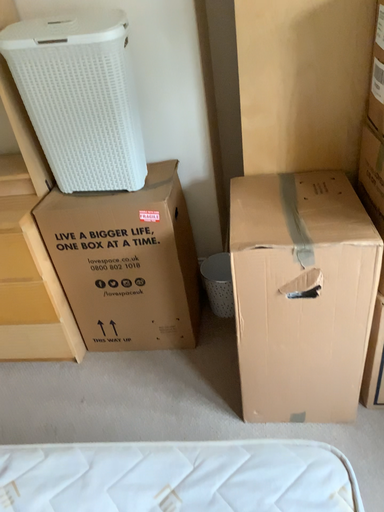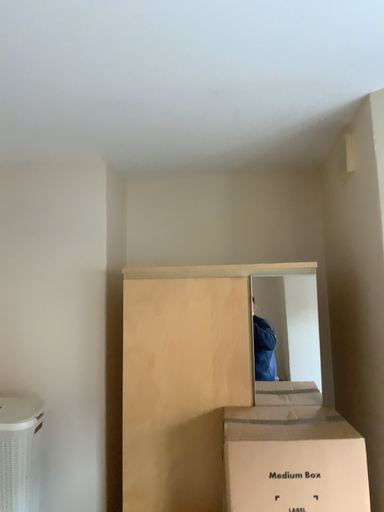
Question: How did the camera likely rotate when shooting the video?

Choices:
 (A) rotated upward
 (B) rotated downward

Answer: (A)